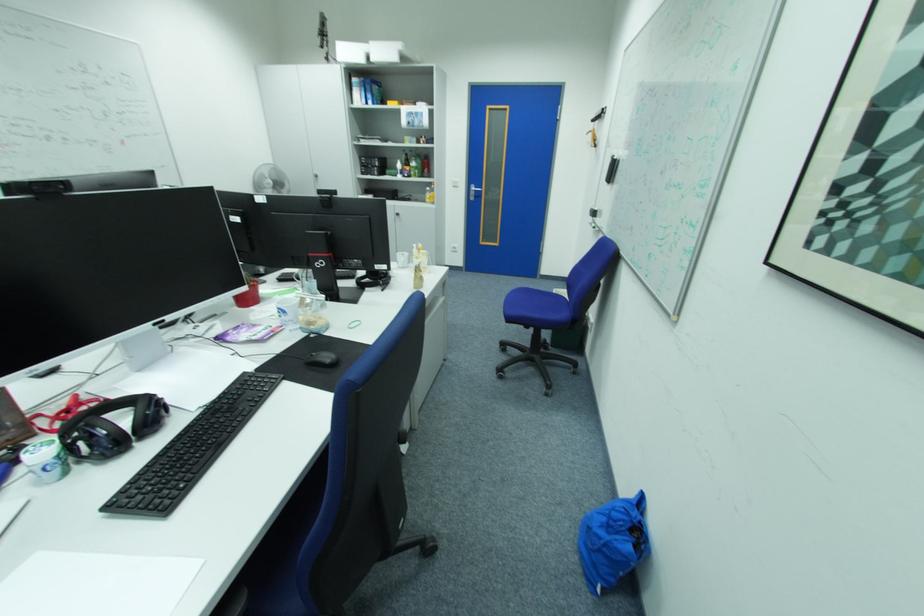
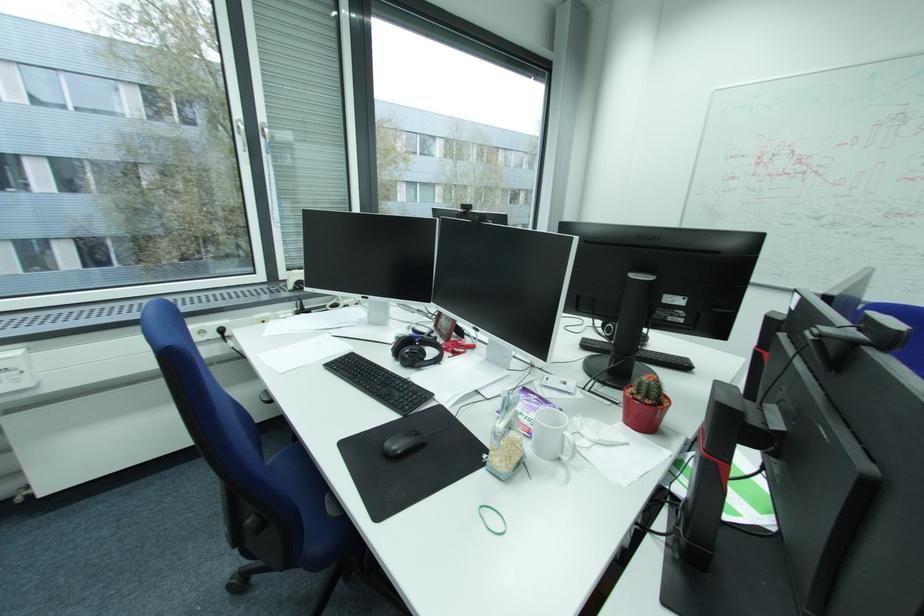
Find the pixel in the second image that matches point 261,309 in the first image.

(629, 424)